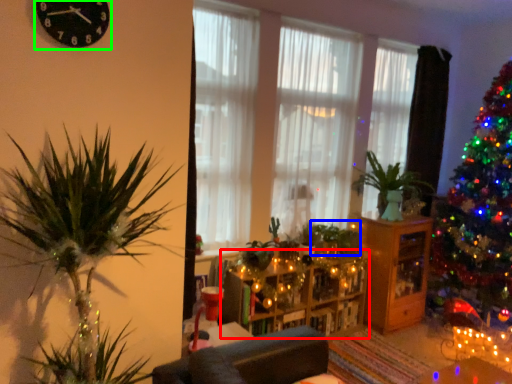
Question: Based on their relative distances, which object is nearer to entertainment center (highlighted by a red box)? Choose from plant (highlighted by a blue box) and clock (highlighted by a green box).

Choices:
 (A) plant
 (B) clock

Answer: (A)